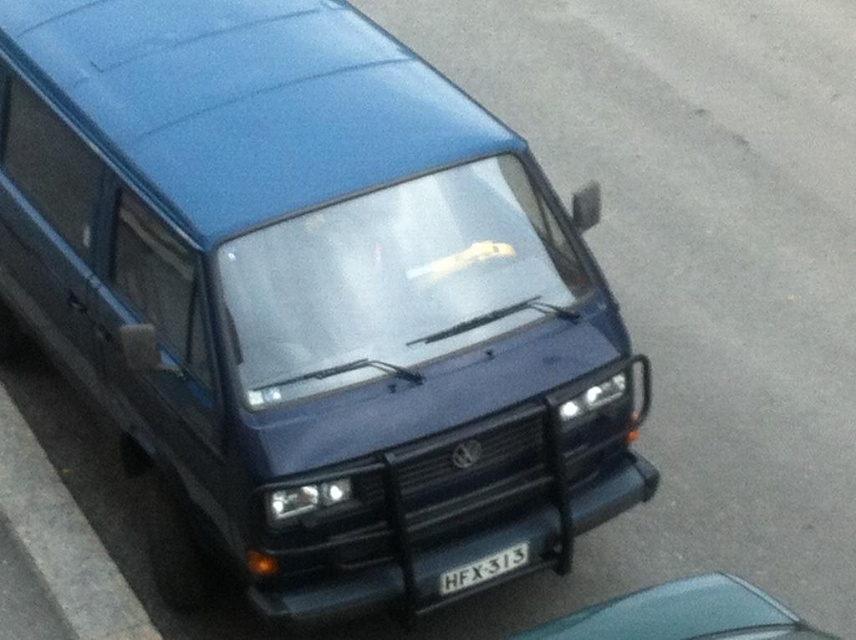
Question: Which of the following is the closest to the observer?

Choices:
 (A) (640, 604)
 (B) (569, 90)

Answer: (A)

Question: Does teal glossy car at lower right appear under white plastic license plate at center?

Choices:
 (A) no
 (B) yes

Answer: (B)

Question: Which of the following is the farthest from the observer?

Choices:
 (A) (4, 481)
 (B) (642, 589)
 (C) (449, 576)

Answer: (A)

Question: Considering the relative positions of gray concrete curb at lower left and white plastic license plate at center in the image provided, where is gray concrete curb at lower left located with respect to white plastic license plate at center?

Choices:
 (A) right
 (B) left

Answer: (B)

Question: From the image, what is the correct spatial relationship of teal glossy car at lower right in relation to white plastic license plate at center?

Choices:
 (A) above
 (B) below

Answer: (B)

Question: Among these points, which one is farthest from the camera?

Choices:
 (A) (67, 531)
 (B) (711, 637)
 (C) (508, 554)
 (D) (825, 355)

Answer: (D)